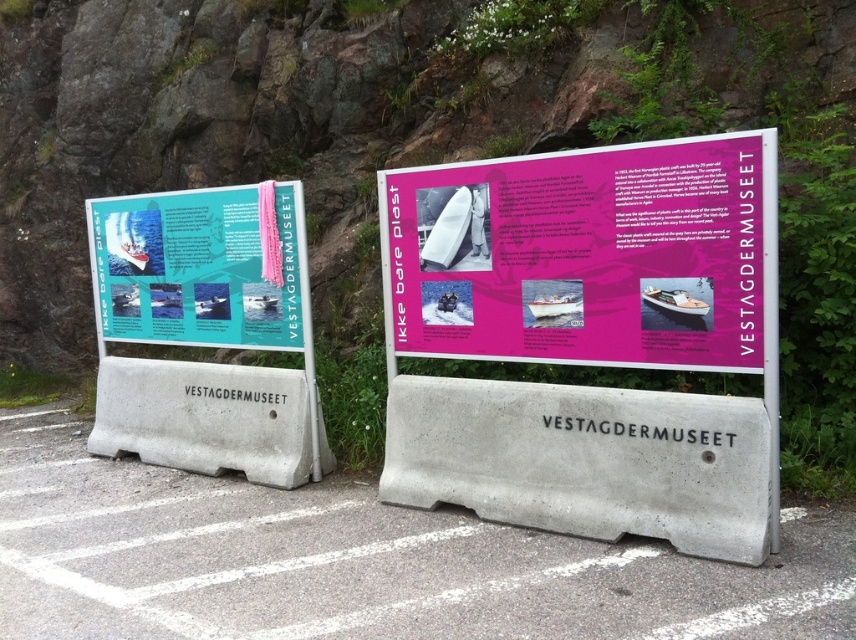
You are standing in front of the two informational boards at Vestagdermuseet. You notice two points marked on the boards. The first point is at coordinates point (643,154) and the second is at point (126,253). Which point is nearer to you?

Point (643,154) is closer to the viewer than point (126,253).

You are standing at the point marked by the coordinates (360, 563). Which object is directly beneath your feet?

The concrete at center is located at point (360, 563), so the object directly beneath your feet is the concrete at center.

You are a visitor at the Vestagdermuseet exhibit and want to take a photo of both the concrete at center and the pink paperboard poster at center. Since the concrete is larger, where should you stand to ensure both are fully visible in your photo?

The concrete at center has a larger size compared to the pink paperboard poster at center, so you should stand farther back to capture both objects in the frame without cropping either.